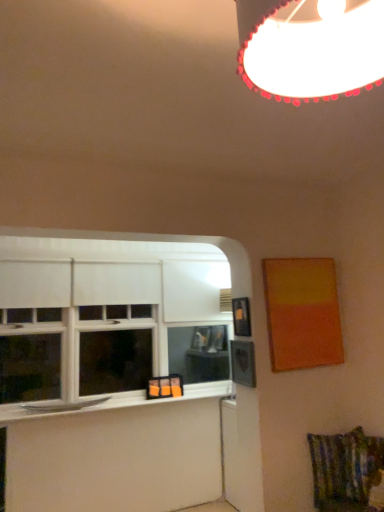
Where is `free point above matte orange painting at right, which is the 2th picture frame in left-to-right order (from a real-world perspective)`? free point above matte orange painting at right, which is the 2th picture frame in left-to-right order (from a real-world perspective) is located at coordinates (295, 256).